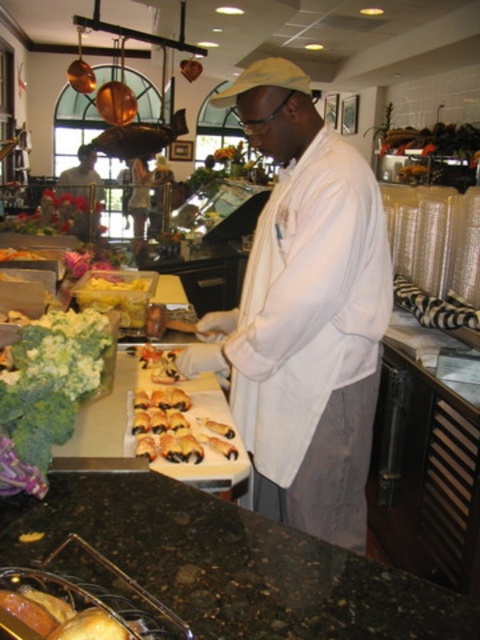
What are the coordinates of `white matte chef coat at center` in the screenshot? It's located at (305, 314).

Which is more to the right, white matte chef coat at center or granite countertop at lower center?

From the viewer's perspective, white matte chef coat at center appears more on the right side.

Measure the distance between point (x=312, y=532) and camera.

Point (x=312, y=532) and camera are 5.37 feet apart.

The width and height of the screenshot is (480, 640). I want to click on white matte chef coat at center, so click(305, 314).

Is point (132, 326) less distant than point (9, 250)?

That is True.

Which is in front, point (116, 276) or point (0, 248)?

Point (116, 276) is more forward.

I want to click on yellow cheese at center, so click(x=118, y=292).

At what (x,y) coordinates should I click in order to perform the action: click on yellow cheese at center. Please return your answer as a coordinate pair (x, y). Looking at the image, I should click on click(118, 292).

Does white matte chef coat at center have a lesser width compared to yellow cheese at center?

No.

Between white matte chef coat at center and yellow cheese at center, which one has less height?

With less height is yellow cheese at center.

The image size is (480, 640). Describe the element at coordinates (305, 314) in the screenshot. I see `white matte chef coat at center` at that location.

The image size is (480, 640). Find the location of `white matte chef coat at center`. white matte chef coat at center is located at coordinates (305, 314).